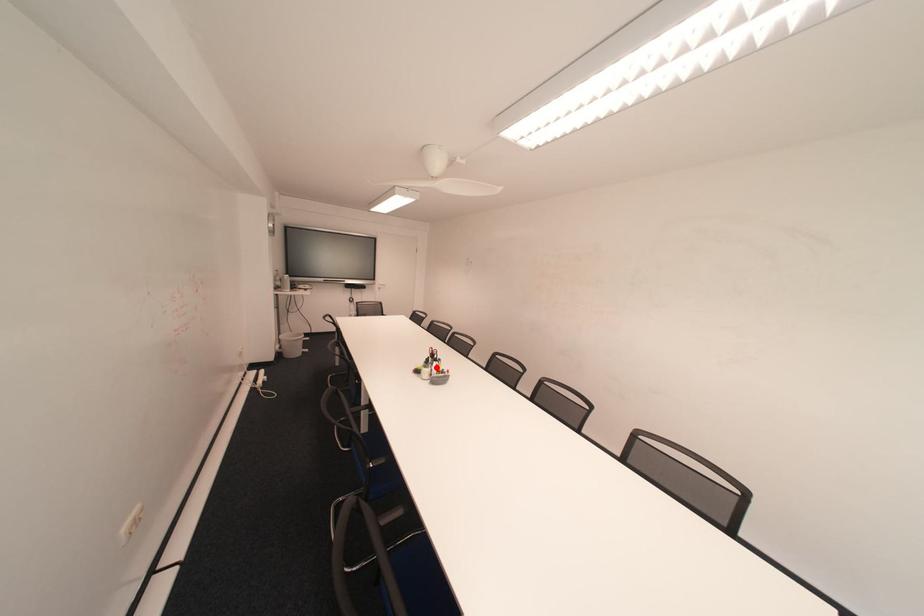
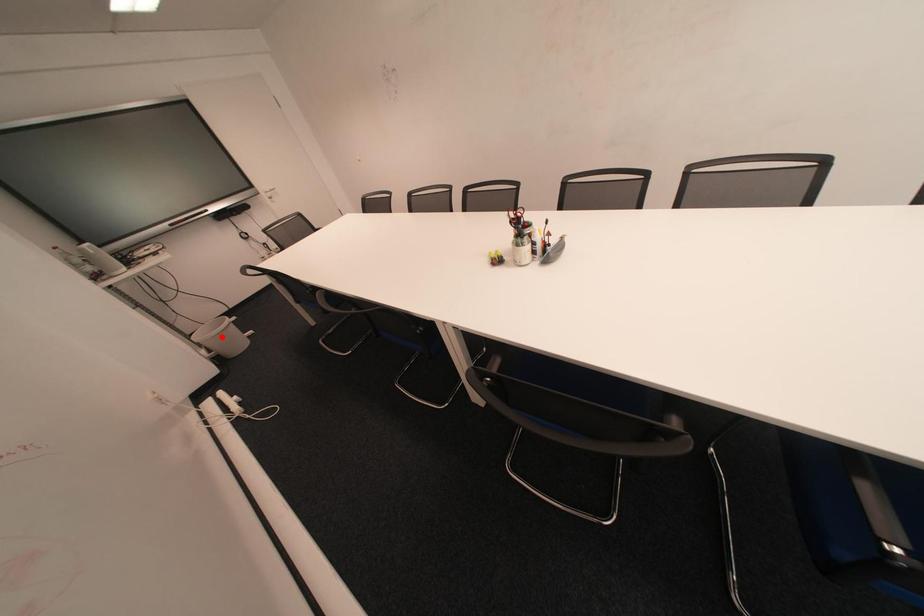
I am providing you with two images of the same scene from different viewpoints. A red point is marked on the first image and another point is marked on the second image. Does the point marked in image1 correspond to the same location as the one in image2?

No